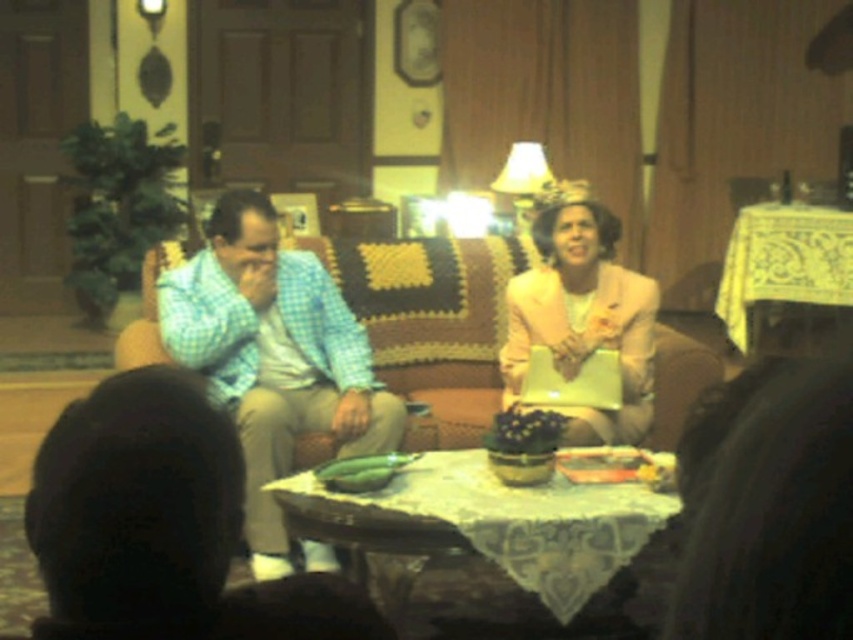
In the vintage living room scene, there is a green fabric couch at center and a yellow lace tablecloth at right. Which object is positioned to the left of the other?

The green fabric couch at center is positioned to the left of the yellow lace tablecloth at right.

In the vintage living room scene, there is a checkered fabric shirt at center and a wooden tablecloth at center. Which object is positioned to the left of the other?

The checkered fabric shirt at center is to the left of wooden tablecloth at center.